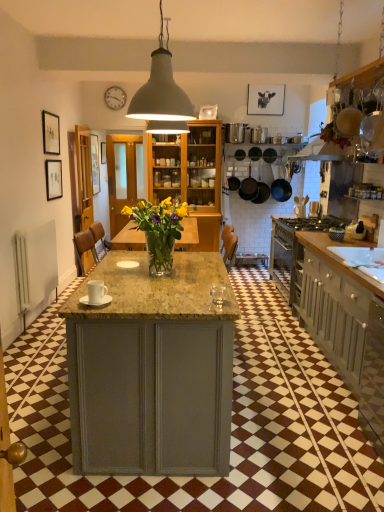
This screenshot has width=384, height=512. What do you see at coordinates (235, 132) in the screenshot?
I see `metallic silver canisters at upper center` at bounding box center [235, 132].

What do you see at coordinates (281, 187) in the screenshot? I see `black matte frying pan at center, arranged as the 2th frying pan when viewed from the back` at bounding box center [281, 187].

Identify the location of matte black picture frame at upper left, marked as the 1th picture frame in a front-to-back arrangement. This screenshot has height=512, width=384. (51, 133).

What do you see at coordinates (348, 121) in the screenshot? I see `matte black frying pan at upper right, the 1th frying pan from the front` at bounding box center [348, 121].

You are a GUI agent. You are given a task and a screenshot of the screen. Output one action in this format:
    pyautogui.click(x=<x>, y=<y>)
    Task: Click on the matte black frying pan at center, which appears as the 1th frying pan when viewed from the back
    
    Given the screenshot: What is the action you would take?
    pyautogui.click(x=248, y=187)

Which object is closer to the camera, matte gray pendant lamp at upper center or translucent glass vase at center?

matte gray pendant lamp at upper center is in front.

From a real-world perspective, which object stands above the other?

matte gray pendant lamp at upper center is physically above.

Who is shorter, matte gray pendant lamp at upper center or translucent glass vase at center?

translucent glass vase at center is shorter.

Based on the photo, measure the distance between matte gray pendant lamp at upper center and translucent glass vase at center.

matte gray pendant lamp at upper center is 3.35 meters away from translucent glass vase at center.

From the image's perspective, is matte black frying pan at center, which appears as the 1th frying pan when viewed from the back, under black matte frying pan at center, arranged as the 2th frying pan when viewed from the back?

No.

Does matte black frying pan at center, placed as the fourth frying pan when sorted from front to back, turn towards black matte frying pan at center, the 3th frying pan from the front?

No, matte black frying pan at center, placed as the fourth frying pan when sorted from front to back, does not turn towards black matte frying pan at center, the 3th frying pan from the front.

Can you confirm if matte black frying pan at center, which appears as the 1th frying pan when viewed from the back, is shorter than black matte frying pan at center, the 3th frying pan from the front?

Correct, matte black frying pan at center, which appears as the 1th frying pan when viewed from the back, is not as tall as black matte frying pan at center, the 3th frying pan from the front.

This screenshot has width=384, height=512. Identify the location of frying pan behind the black matte frying pan at center, arranged as the 2th frying pan when viewed from the back. (248, 187).

From the image's perspective, which is below, matte black picture frame at upper left, the 2th picture frame from the left, or matte black frying pan at upper right, the 1th frying pan from the front?

matte black frying pan at upper right, the 1th frying pan from the front.

Is matte black picture frame at upper left, marked as the 1th picture frame in a front-to-back arrangement, oriented away from matte black frying pan at upper right, the fourth frying pan viewed from the back?

That's not correct — matte black picture frame at upper left, marked as the 1th picture frame in a front-to-back arrangement, is not looking away from matte black frying pan at upper right, the fourth frying pan viewed from the back.

From a real-world perspective, is matte black picture frame at upper left, which is counted as the 3th picture frame, starting from the right, beneath matte black frying pan at upper right, the fourth frying pan viewed from the back?

Yes, from a real-world perspective, matte black picture frame at upper left, which is counted as the 3th picture frame, starting from the right, is beneath matte black frying pan at upper right, the fourth frying pan viewed from the back.

Is matte black picture frame at upper left, marked as the 1th picture frame in a front-to-back arrangement, taller or shorter than matte black frying pan at upper right, the fourth frying pan viewed from the back?

Clearly, matte black picture frame at upper left, marked as the 1th picture frame in a front-to-back arrangement, is taller compared to matte black frying pan at upper right, the fourth frying pan viewed from the back.

In the scene shown: How different are the orientations of white glossy sink at right and matte black frying pan at center, placed as the fourth frying pan when sorted from front to back, in degrees?

89.5 degrees separate the facing orientations of white glossy sink at right and matte black frying pan at center, placed as the fourth frying pan when sorted from front to back.

Is point (342, 258) closer or farther from the camera than point (250, 189)?

Clearly, point (342, 258) is closer to the camera than point (250, 189).

Consider the image. Which of these two, white glossy sink at right or matte black frying pan at center, placed as the fourth frying pan when sorted from front to back, is thinner?

Thinner between the two is matte black frying pan at center, placed as the fourth frying pan when sorted from front to back.

What's the angular difference between white glossy toaster at right, the first appliance positioned from the right, and black matte frying pan at center, arranged as the 2th frying pan when viewed from the back,'s facing directions?

The angular difference between white glossy toaster at right, the first appliance positioned from the right, and black matte frying pan at center, arranged as the 2th frying pan when viewed from the back, is 90.1 degrees.

From a real-world perspective, who is located lower, white glossy toaster at right, the first appliance positioned from the right, or black matte frying pan at center, arranged as the 2th frying pan when viewed from the back?

white glossy toaster at right, the first appliance positioned from the right.

Between white glossy toaster at right, the first appliance positioned from the right, and black matte frying pan at center, arranged as the 2th frying pan when viewed from the back, which one appears on the right side from the viewer's perspective?

white glossy toaster at right, the first appliance positioned from the right, is more to the right.

Is white glossy toaster at right, which appears as the second appliance when viewed from the left, wider or thinner than black matte frying pan at center, the 3th frying pan from the front?

white glossy toaster at right, which appears as the second appliance when viewed from the left, is thinner than black matte frying pan at center, the 3th frying pan from the front.

Based on the photo, is dark brown matte frying pan at center, acting as the third frying pan starting from the back, facing away from black matte frying pan at center, the 3th frying pan from the front?

dark brown matte frying pan at center, acting as the third frying pan starting from the back, does not have its back to black matte frying pan at center, the 3th frying pan from the front.

Is dark brown matte frying pan at center, arranged as the 2th frying pan when viewed from the front, further to camera compared to black matte frying pan at center, arranged as the 2th frying pan when viewed from the back?

No, dark brown matte frying pan at center, arranged as the 2th frying pan when viewed from the front, is in front of black matte frying pan at center, arranged as the 2th frying pan when viewed from the back.

In the scene shown: From a real-world perspective, is dark brown matte frying pan at center, acting as the third frying pan starting from the back, positioned above or below black matte frying pan at center, arranged as the 2th frying pan when viewed from the back?

Clearly, from a real-world perspective, dark brown matte frying pan at center, acting as the third frying pan starting from the back, is above black matte frying pan at center, arranged as the 2th frying pan when viewed from the back.

Would you say dark brown matte frying pan at center, arranged as the 2th frying pan when viewed from the front, is outside black matte frying pan at center, arranged as the 2th frying pan when viewed from the back?

Absolutely, dark brown matte frying pan at center, arranged as the 2th frying pan when viewed from the front, is external to black matte frying pan at center, arranged as the 2th frying pan when viewed from the back.

From the image's perspective, is matte black frying pan at center, placed as the fourth frying pan when sorted from front to back, below dark brown matte frying pan at center, arranged as the 2th frying pan when viewed from the front?

Incorrect, from the image's perspective, matte black frying pan at center, placed as the fourth frying pan when sorted from front to back, is higher than dark brown matte frying pan at center, arranged as the 2th frying pan when viewed from the front.

Is matte black frying pan at center, placed as the fourth frying pan when sorted from front to back, aimed at dark brown matte frying pan at center, acting as the third frying pan starting from the back?

No, matte black frying pan at center, placed as the fourth frying pan when sorted from front to back, is not aimed at dark brown matte frying pan at center, acting as the third frying pan starting from the back.

From the picture: Between matte black frying pan at center, placed as the fourth frying pan when sorted from front to back, and dark brown matte frying pan at center, acting as the third frying pan starting from the back, which one is positioned behind?

Positioned behind is matte black frying pan at center, placed as the fourth frying pan when sorted from front to back.

Find the location of a particular element. light fixture on the right of translucent glass vase at center is located at coordinates pos(162,94).

The height and width of the screenshot is (512, 384). I want to click on frying pan that is the 3rd one when counting leftward from the black matte frying pan at center, the 3th frying pan from the front, so click(x=248, y=187).

From the image, which object appears to be farther from white glossy sink at right, white ceramic mug at center, the second appliance when ordered from back to front, or matte black picture frame at left, the second picture frame when ordered from front to back?

Among the two, matte black picture frame at left, the second picture frame when ordered from front to back, is located further to white glossy sink at right.

Estimate the real-world distances between objects in this image. Which object is closer to matte black frying pan at upper right, the fourth frying pan viewed from the back, matte black frying pan at center, which appears as the 1th frying pan when viewed from the back, or dark brown matte frying pan at center, arranged as the 2th frying pan when viewed from the front?

Based on the image, matte black frying pan at center, which appears as the 1th frying pan when viewed from the back, appears to be nearer to matte black frying pan at upper right, the fourth frying pan viewed from the back.

Looking at the image, which one is located further to white glossy sink at right, matte black picture frame at left, the 1th picture frame from the bottom, or matte gray cabinet at right?

matte black picture frame at left, the 1th picture frame from the bottom.

When comparing their distances from matte black cow portrait at upper center, the 4th picture frame when ordered from left to right, does white wooden clock at upper center or translucent glass vase at center seem further?

translucent glass vase at center is further to matte black cow portrait at upper center, the 4th picture frame when ordered from left to right.

Based on their spatial positions, is black matte frying pan at center, arranged as the 2th frying pan when viewed from the back, or white glossy sink at right closer to matte black picture frame at upper left, marked as the 2th picture frame in a bottom-to-top arrangement?

The object closer to matte black picture frame at upper left, marked as the 2th picture frame in a bottom-to-top arrangement, is black matte frying pan at center, arranged as the 2th frying pan when viewed from the back.

Considering their positions, is matte black cow portrait at upper center, which is the 4th picture frame in front-to-back order, positioned closer to metallic silver canisters at upper center than translucent glass vase at center?

matte black cow portrait at upper center, which is the 4th picture frame in front-to-back order, lies closer to metallic silver canisters at upper center than the other object.

Which object lies further to the anchor point matte black picture frame at left, the third picture frame in the back-to-front sequence, metallic silver canisters at upper center or matte gray cabinet at right?

matte gray cabinet at right lies further to matte black picture frame at left, the third picture frame in the back-to-front sequence, than the other object.

Which object lies nearer to the anchor point matte black frying pan at center, placed as the fourth frying pan when sorted from front to back, matte black picture frame at upper left, the third picture frame when ordered from top to bottom, or matte black frying pan at upper right, the fourth frying pan viewed from the back?

matte black picture frame at upper left, the third picture frame when ordered from top to bottom.

Locate an element on the screen. This screenshot has height=512, width=384. clock between matte black picture frame at upper left, the third picture frame when ordered from top to bottom, and metallic silver canisters at upper center, in the horizontal direction is located at coordinates (115, 98).

Where is `appliance positioned between matte gray cabinet at right and matte black frying pan at center, which appears as the 1th frying pan when viewed from the back, from near to far`? The width and height of the screenshot is (384, 512). appliance positioned between matte gray cabinet at right and matte black frying pan at center, which appears as the 1th frying pan when viewed from the back, from near to far is located at coordinates (355, 230).

Locate an element on the screen. This screenshot has height=512, width=384. picture frame between white wooden clock at upper center and matte black frying pan at center, which appears as the 1th frying pan when viewed from the back, from left to right is located at coordinates (208, 112).

I want to click on cabinetry positioned between white glossy sink at right and dark brown matte frying pan at center, arranged as the 2th frying pan when viewed from the front, from near to far, so point(343,323).